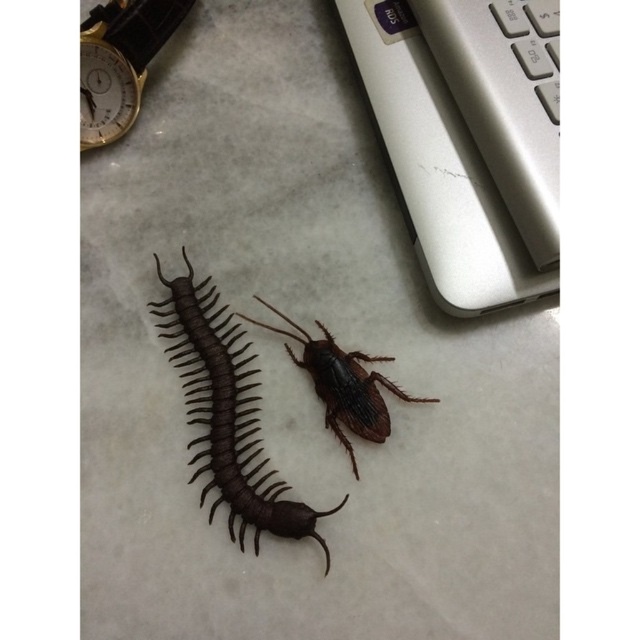
Which is more to the left, brown matte centipede at center-left or gold metallic clock at upper left?

gold metallic clock at upper left

Looking at this image, does brown matte centipede at center-left appear on the right side of gold metallic clock at upper left?

Correct, you'll find brown matte centipede at center-left to the right of gold metallic clock at upper left.

Is point (230, 472) farther from camera compared to point (97, 38)?

No, it is not.

Find the location of `brown matte centipede at center-left`. brown matte centipede at center-left is located at coordinates (228, 417).

Does shiny brown beetle at center appear on the right side of gold metallic clock at upper left?

Correct, you'll find shiny brown beetle at center to the right of gold metallic clock at upper left.

Where is `shiny brown beetle at center`? This screenshot has width=640, height=640. shiny brown beetle at center is located at coordinates (342, 385).

Which is in front, point (282, 316) or point (93, 36)?

Point (93, 36) is in front.

Identify the location of shiny brown beetle at center. (342, 385).

Does brown matte centipede at center-left appear on the right side of gold metallic watch at upper left?

Indeed, brown matte centipede at center-left is positioned on the right side of gold metallic watch at upper left.

In order to click on brown matte centipede at center-left in this screenshot , I will do `click(228, 417)`.